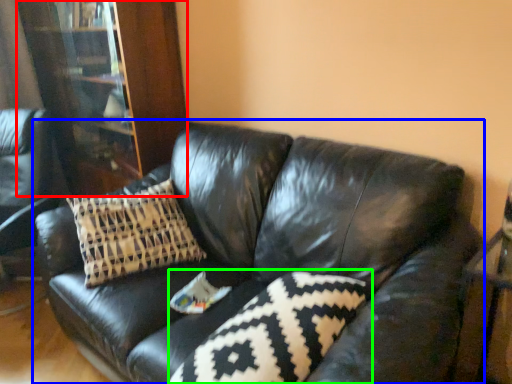
Question: Estimate the real-world distances between objects in this image. Which object is closer to bookcase (highlighted by a red box), studio couch (highlighted by a blue box) or pillow (highlighted by a green box)?

Choices:
 (A) studio couch
 (B) pillow

Answer: (A)